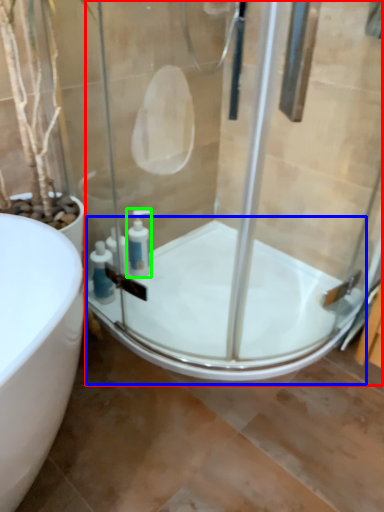
Question: Which object is positioned closest to shower door (highlighted by a red box)? Select from bath (highlighted by a blue box) and soap dispenser (highlighted by a green box).

Choices:
 (A) bath
 (B) soap dispenser

Answer: (A)